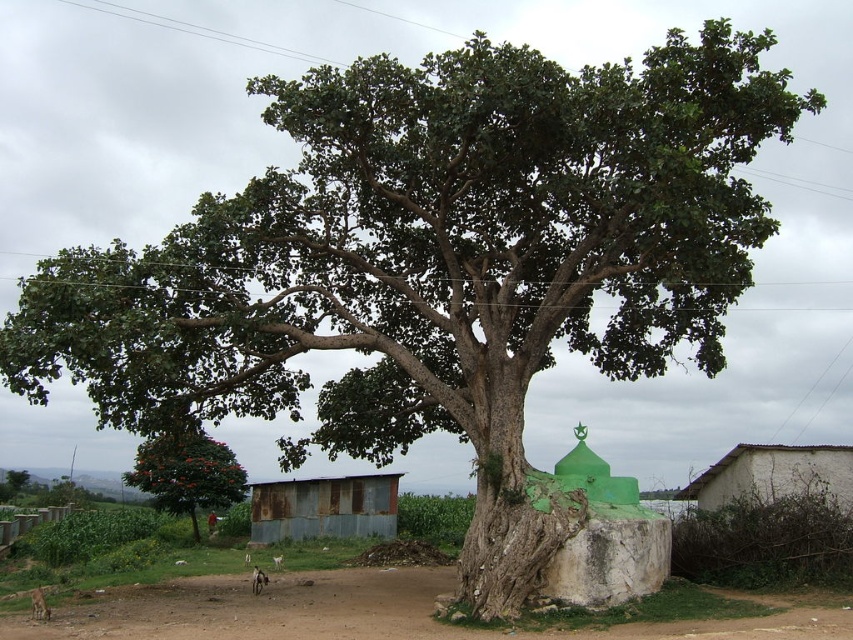
You are a farmer planning to plant crops in the brown dirt field at lower center. You have a tractor that is 3 meters wide. Can the tractor pass through the rusty metal hut at lower center without any modifications?

The brown dirt field at lower center is wider than the rusty metal hut at lower center, but the question is about the tractor passing through the hut. Since the description only mentions the field being wider than the hut, there is no information provided about the width of the entrance or space around the hut. Therefore, it is unclear if the tractor can pass through the rusty metal hut at lower center.

You are standing at the edge of the brown dirt field at lower center and want to walk to the rusty metal hut at lower center. Which direction should you head to reach the hut?

You should head to the left because the brown dirt field at lower center is positioned on the right side of the rusty metal hut at lower center, meaning the hut is to your left.

You are standing in the rural scene and want to walk from the brown dirt field at lower center to the white stucco hut at lower right. Which direction should you head?

You should head to the right because the brown dirt field at lower center is to the left of the white stucco hut at lower right.